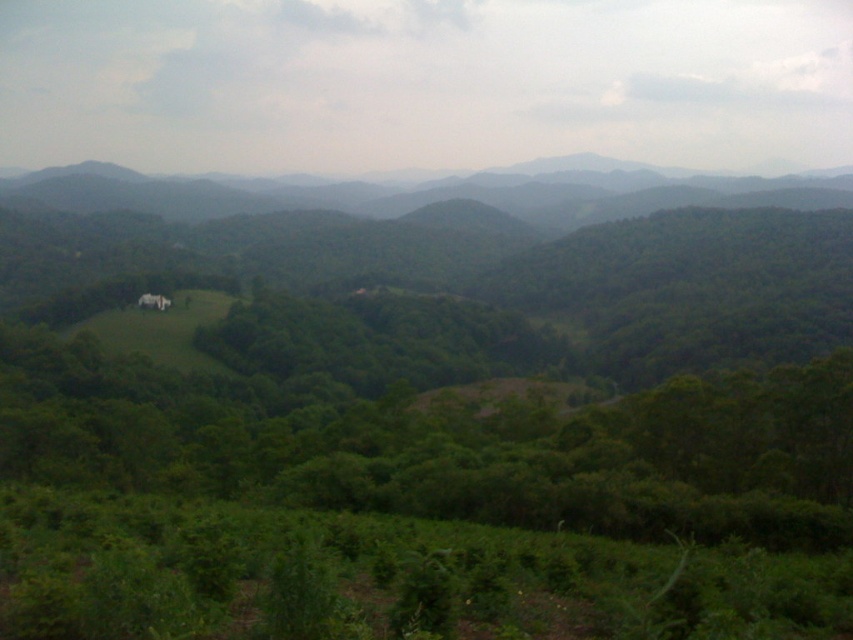
Question: Observing the image, what is the correct spatial positioning of green leafy tree at center in reference to green forested mountain at upper center?

Choices:
 (A) left
 (B) right

Answer: (B)

Question: Which object appears farthest from the camera in this image?

Choices:
 (A) green leafy tree at center
 (B) green forested mountain at upper center

Answer: (B)

Question: Does green leafy tree at center come in front of green forested mountain at upper center?

Choices:
 (A) yes
 (B) no

Answer: (A)

Question: Is green leafy tree at center positioned in front of green forested mountain at upper center?

Choices:
 (A) no
 (B) yes

Answer: (B)

Question: Which point is closer to the camera taking this photo?

Choices:
 (A) (534, 461)
 (B) (560, 179)

Answer: (A)

Question: Which point is farther to the camera?

Choices:
 (A) green forested mountain at upper center
 (B) green leafy tree at center

Answer: (A)